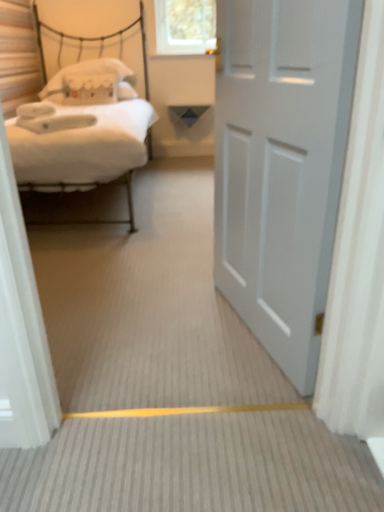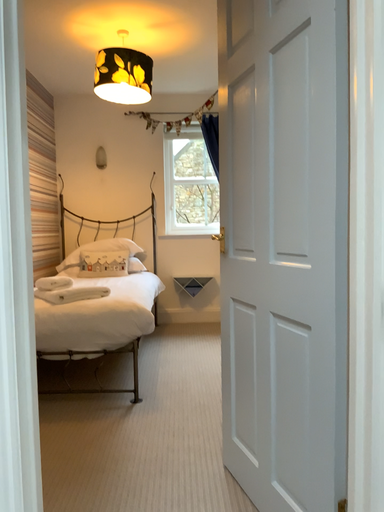
Question: Which way did the camera rotate in the video?

Choices:
 (A) rotated downward
 (B) rotated upward

Answer: (B)